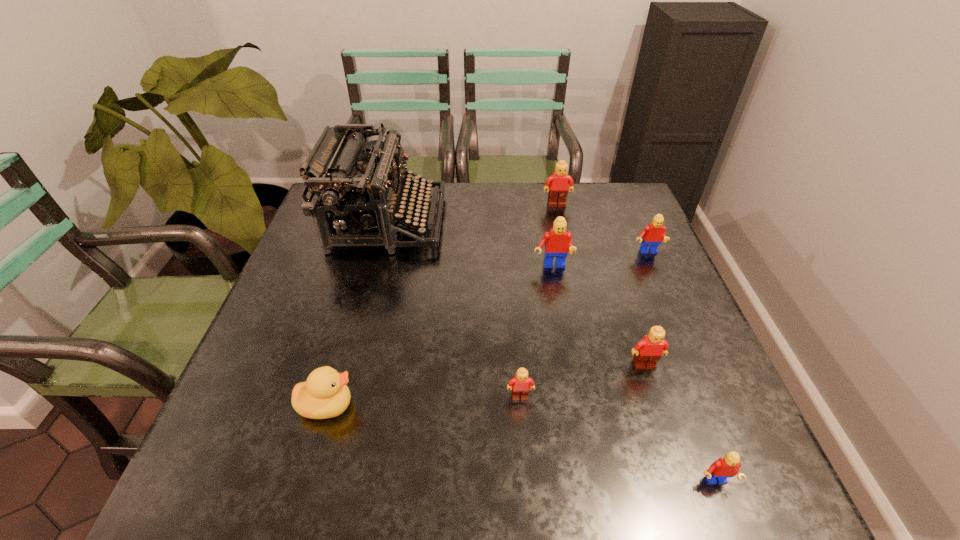
Where is `vacant space at the left edge of the desktop`? vacant space at the left edge of the desktop is located at coordinates (340, 253).

Identify the location of free space at the right edge of the desktop. Image resolution: width=960 pixels, height=540 pixels. (723, 399).

The height and width of the screenshot is (540, 960). Find the location of `free space at the near left corner of the desktop`. free space at the near left corner of the desktop is located at coordinates (248, 495).

You are a GUI agent. You are given a task and a screenshot of the screen. Output one action in this format:
    pyautogui.click(x=<x>, y=<y>)
    Task: Click on the vacant area between the second farthest red Lego and the smallest brown Lego
    
    Given the screenshot: What is the action you would take?
    pyautogui.click(x=536, y=332)

Where is `vacant region between the tallest object and the second farthest red Lego`? vacant region between the tallest object and the second farthest red Lego is located at coordinates (469, 244).

The height and width of the screenshot is (540, 960). What are the coordinates of `vacant area between the farthest Lego and the nearest red Lego` in the screenshot? It's located at (636, 343).

The image size is (960, 540). In order to click on vacant point located between the farthest brown Lego and the tallest object in this screenshot , I will do (472, 213).

Find the location of a particular element. The height and width of the screenshot is (540, 960). blank region between the duckling and the leftmost Lego is located at coordinates (423, 401).

What are the coordinates of `vacant area that lies between the sixth object from right to left and the yellow duckling` in the screenshot? It's located at (423, 401).

Find the location of a particular element. The height and width of the screenshot is (540, 960). free space between the nearest Lego and the typewriter is located at coordinates (551, 352).